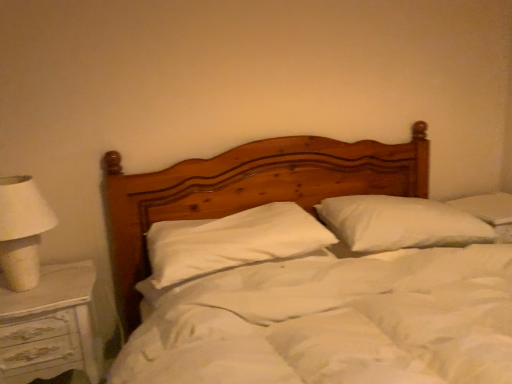
Question: Considering their positions, is white fabric lampshade at left located in front of or behind wooden bed at center?

Choices:
 (A) behind
 (B) front

Answer: (A)

Question: In terms of width, does white fabric lampshade at left look wider or thinner when compared to wooden bed at center?

Choices:
 (A) thin
 (B) wide

Answer: (A)

Question: Considering the real-world distances, which object is farthest from the white painted wood nightstand at left?

Choices:
 (A) white fabric lampshade at left
 (B) white soft pillow at center, the 1th pillow when ordered from left to right
 (C) wooden bed at center
 (D) white soft pillow at center, which is counted as the second pillow, starting from the left

Answer: (D)

Question: Estimate the real-world distances between objects in this image. Which object is closer to the white soft pillow at center, the 1th pillow in the right-to-left sequence?

Choices:
 (A) white painted wood nightstand at left
 (B) white soft pillow at center, which is counted as the 2th pillow, starting from the right
 (C) white fabric lampshade at left
 (D) wooden bed at center

Answer: (D)